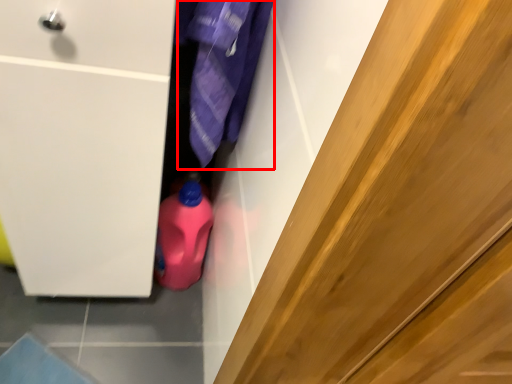
Question: From the image's perspective, what is the correct spatial positioning of clothing (annotated by the red box) in reference to cleaning product?

Choices:
 (A) below
 (B) above

Answer: (B)